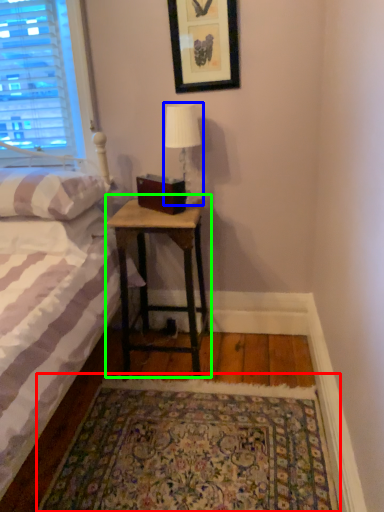
Question: Which object is the farthest from mat (highlighted by a red box)? Choose among these: table lamp (highlighted by a blue box) or nightstand (highlighted by a green box).

Choices:
 (A) table lamp
 (B) nightstand

Answer: (A)